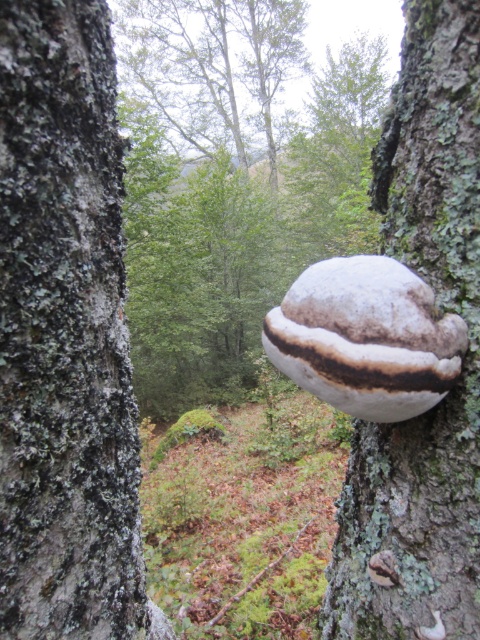
Does white fuzzy fungus at center have a lesser width compared to white fuzzy growth at center?

In fact, white fuzzy fungus at center might be wider than white fuzzy growth at center.

Based on the photo, which of these two, white fuzzy fungus at center or white fuzzy growth at center, stands taller?

Standing taller between the two is white fuzzy fungus at center.

The width and height of the screenshot is (480, 640). What do you see at coordinates (231, 182) in the screenshot? I see `white fuzzy fungus at center` at bounding box center [231, 182].

Image resolution: width=480 pixels, height=640 pixels. Identify the location of white fuzzy fungus at center. (231, 182).

Locate an element on the screen. This screenshot has width=480, height=640. smooth gray bark at center is located at coordinates (66, 337).

Between smooth gray bark at center and white fuzzy fungus at center, which one is positioned higher?

white fuzzy fungus at center is above.

Is point (3, 388) farther from viewer compared to point (240, 337)?

No, (3, 388) is closer to viewer.

Image resolution: width=480 pixels, height=640 pixels. Find the location of `smooth gray bark at center`. smooth gray bark at center is located at coordinates (66, 337).

Which is behind, point (195, 132) or point (455, 344)?

The point (195, 132) is behind.

Does white fuzzy fungus at center appear over white matte fungus at right?

Yes.

Does point (277, 209) come behind point (452, 344)?

Yes, it is behind point (452, 344).

The width and height of the screenshot is (480, 640). I want to click on white fuzzy fungus at center, so click(231, 182).